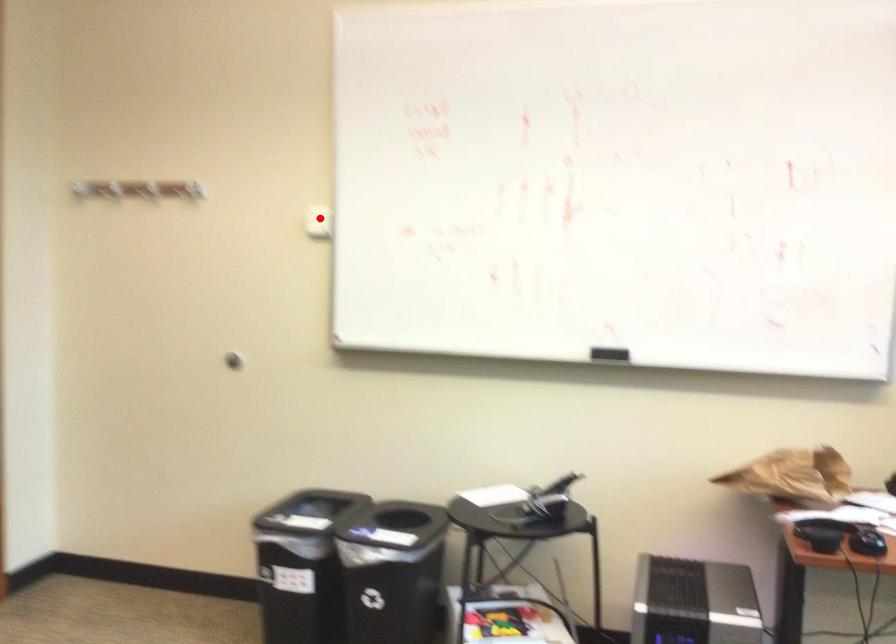
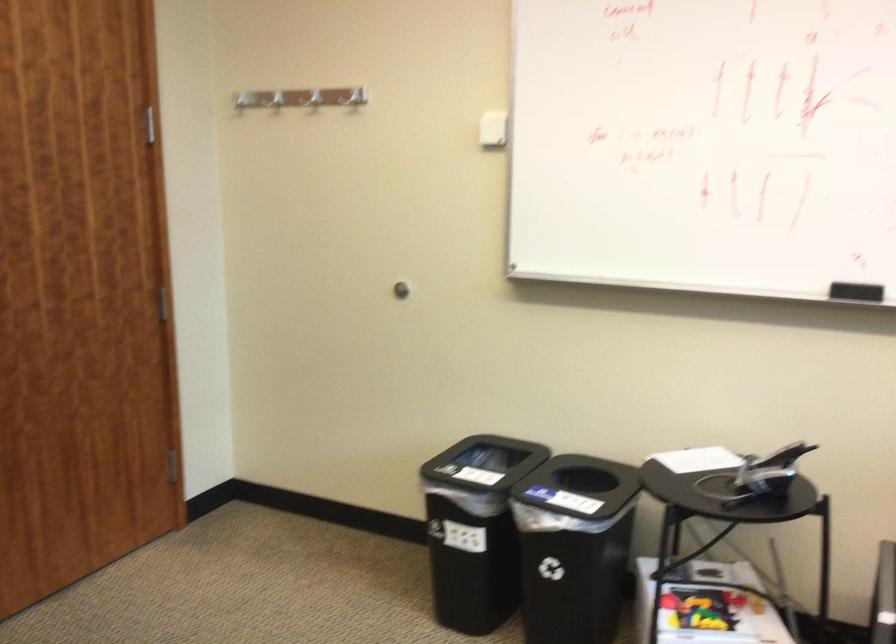
Question: A red point is marked in image1. In image2, is the corresponding 3D point closer to the camera or farther? Reply with the corresponding letter.

Choices:
 (A) The corresponding 3D point is closer.
 (B) The corresponding 3D point is farther.

Answer: (A)